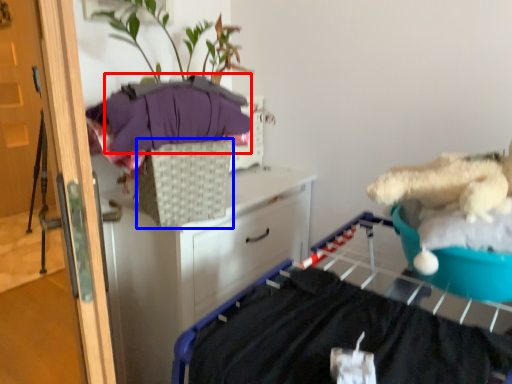
Question: Which of the following is the closest to the observer, clothing (highlighted by a red box) or basket (highlighted by a blue box)?

Choices:
 (A) clothing
 (B) basket

Answer: (A)